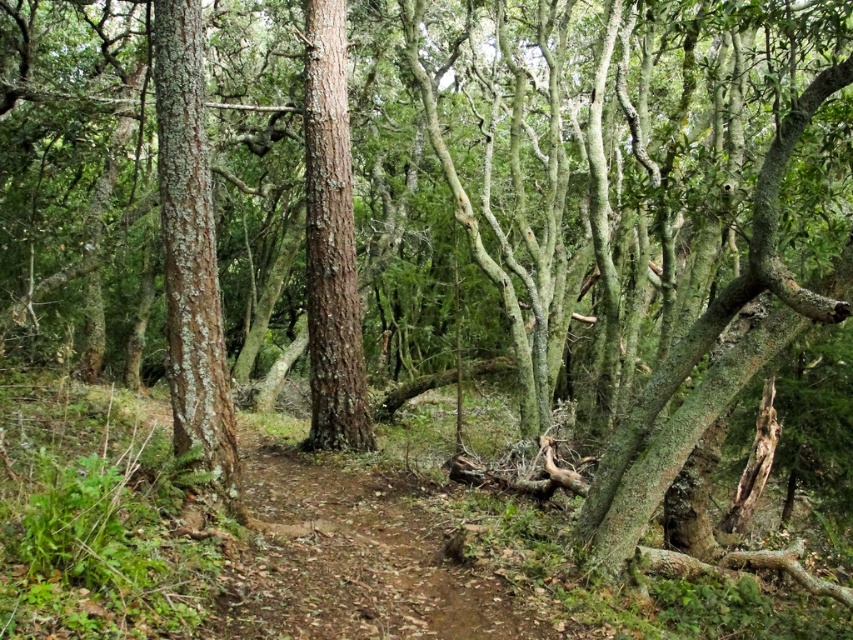
Is point (209, 228) behind point (326, 230)?

No, it is not.

Find the location of a particular element. The image size is (853, 640). green lichen-covered tree trunk at center-left is located at coordinates (190, 252).